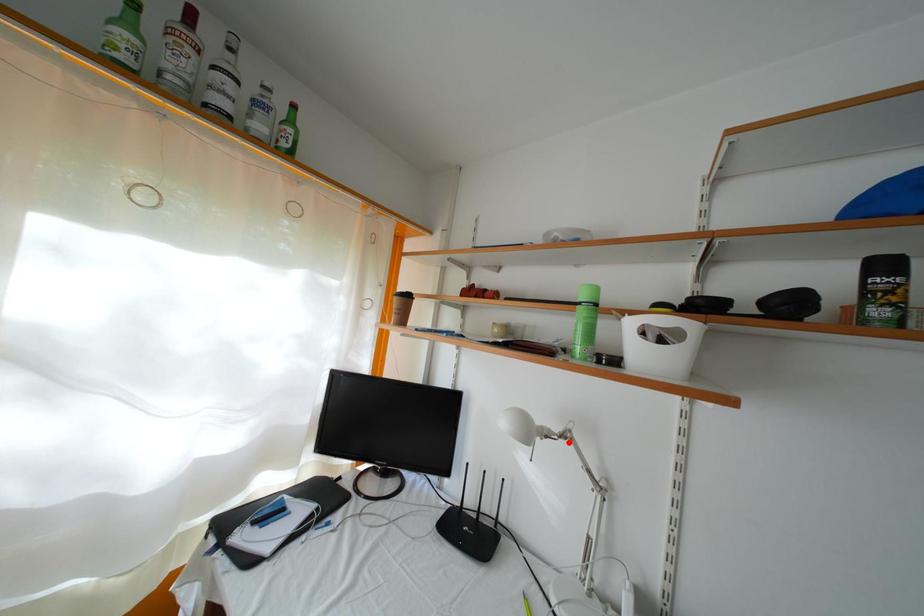
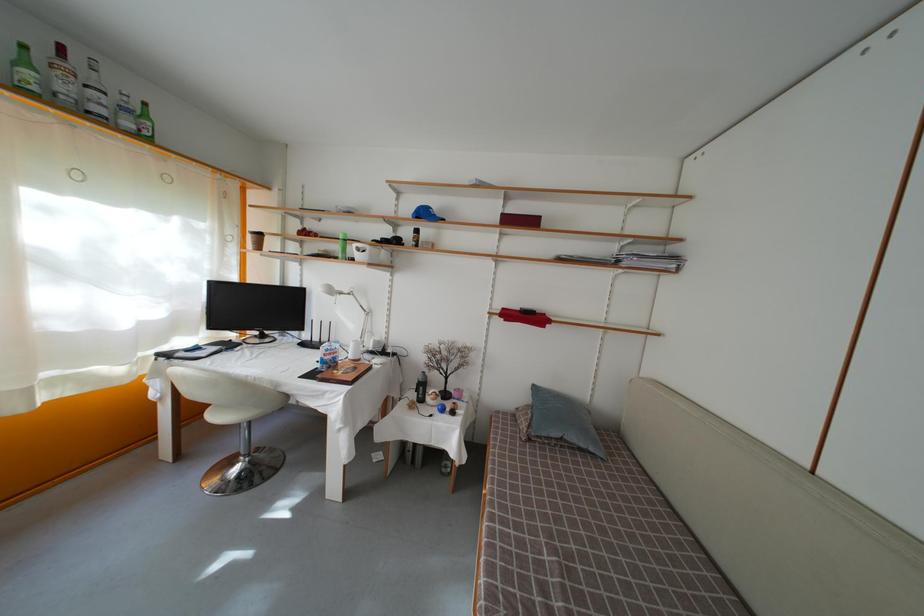
Where in the second image is the point corresponding to the highlighted location from the first image?

(355, 301)